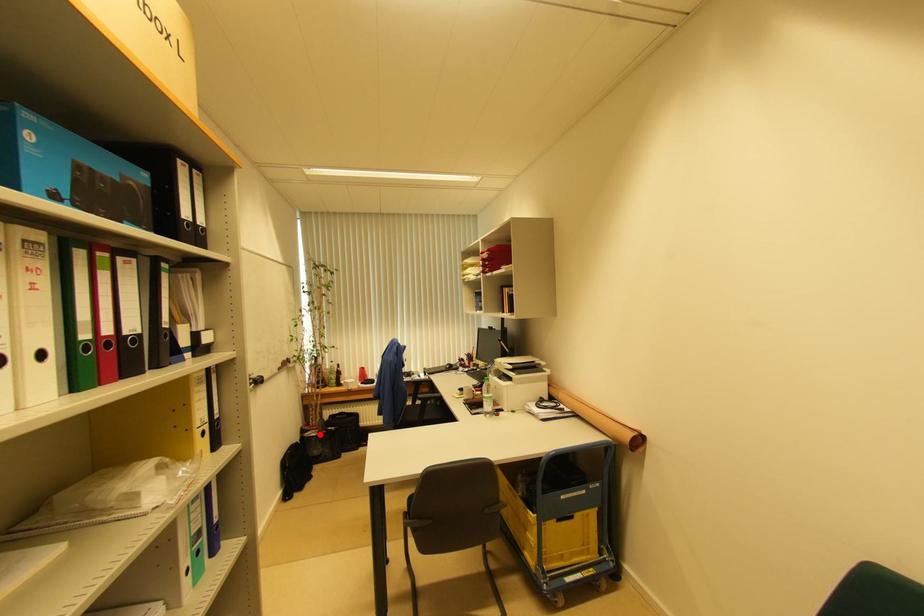
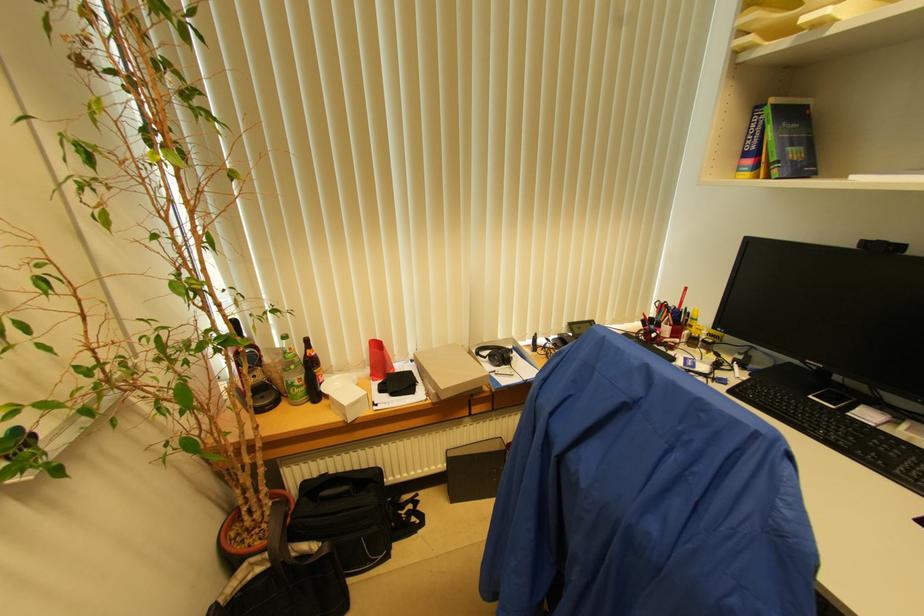
Question: I am providing you with two images of the same scene from different viewpoints. Image1 has a red point marked. In image2, the corresponding 3D location appears at what relative position? Reply with the corresponding letter.

Choices:
 (A) Closer
 (B) Farther

Answer: (A)